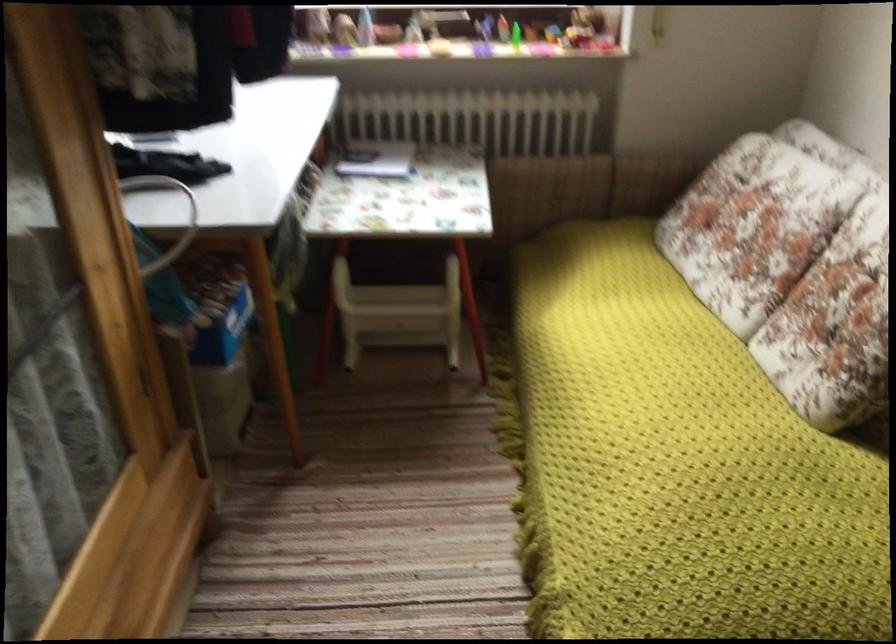
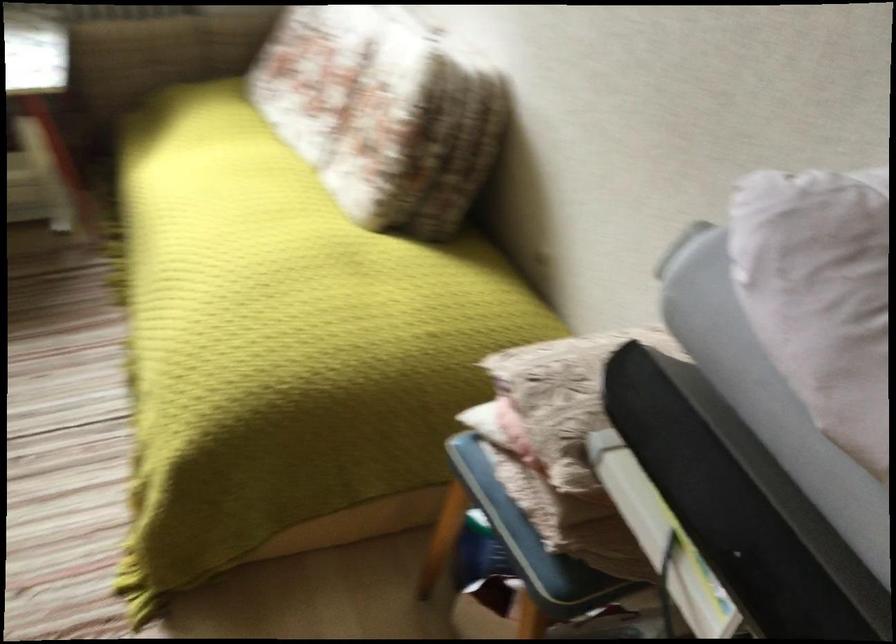
Question: I am providing you with two images of the same scene from different viewpoints. Which of the following objects are not visible in image2?

Choices:
 (A) chair sitting surface
 (B) sofa sitting surface
 (C) patterned cushion
 (D) none of these

Answer: (D)